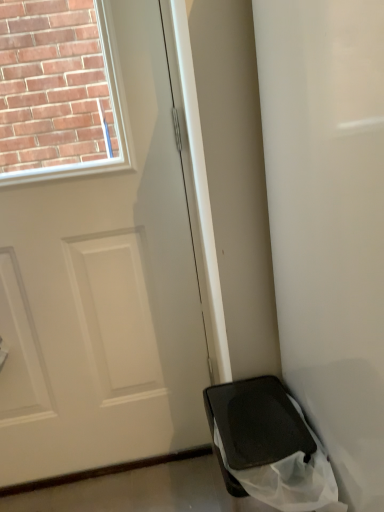
Question: Relative to white matte door at center, is black matte bag at lower right in front or behind?

Choices:
 (A) front
 (B) behind

Answer: (A)

Question: Is black matte bag at lower right bigger or smaller than white matte door at center?

Choices:
 (A) small
 (B) big

Answer: (B)

Question: Considering the real-world distances, which object is closest to the white matte door at center?

Choices:
 (A) black matte bag at lower right
 (B) black matte trash can at lower right

Answer: (B)

Question: Which object is positioned closest to the black matte trash can at lower right?

Choices:
 (A) black matte bag at lower right
 (B) white matte door at center

Answer: (A)